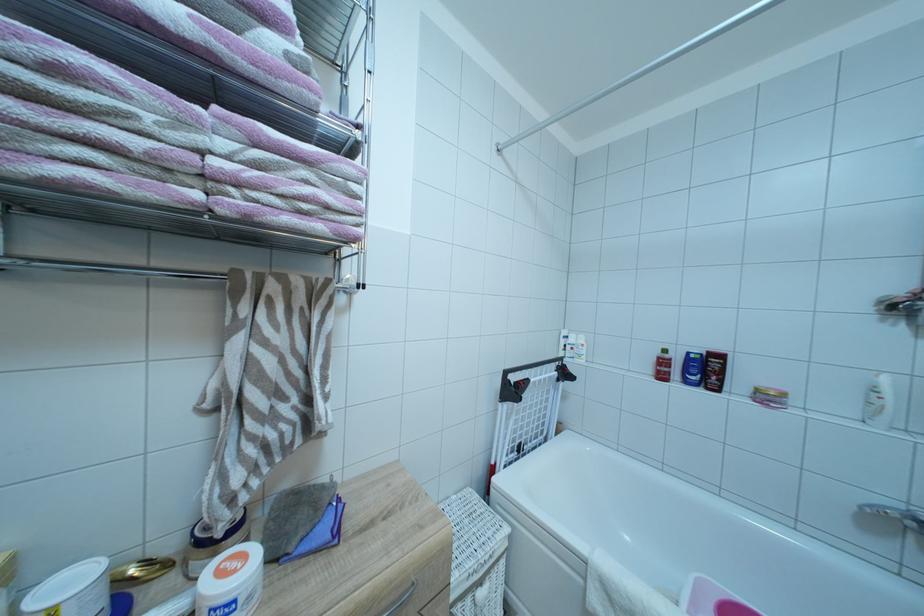
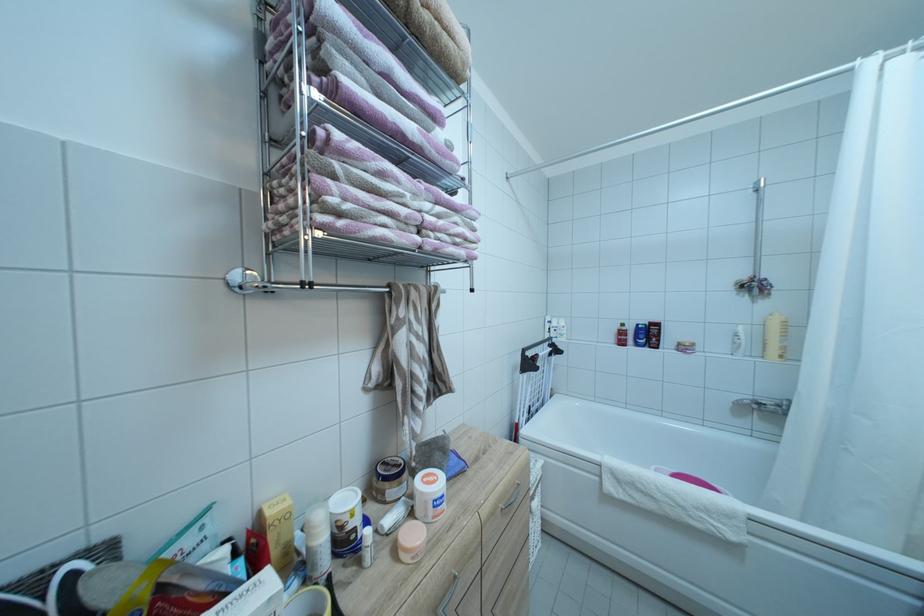
Locate, in the second image, the point that corresponds to point 241,578 in the first image.

(442, 487)